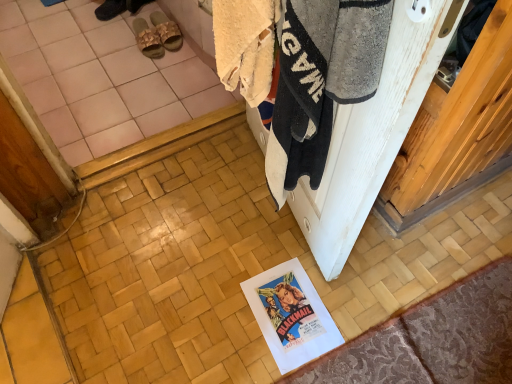
At what (x,y) coordinates should I click in order to perform the action: click on vacant space to the left of beige fabric slipper at upper left, which ranks as the second footwear in right-to-left order. Please return your answer as a coordinate pair (x, y). This screenshot has height=384, width=512. Looking at the image, I should click on (109, 39).